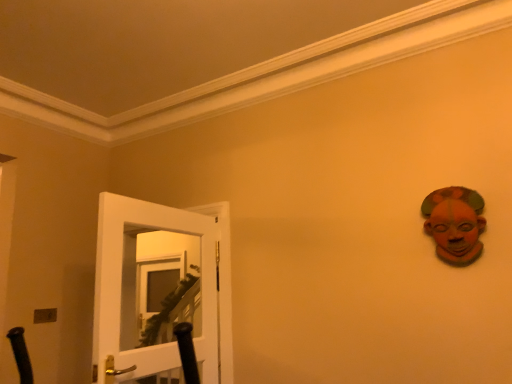
Question: Does point (454, 263) appear closer or farther from the camera than point (118, 370)?

Choices:
 (A) closer
 (B) farther

Answer: (B)

Question: Relative to white glossy door at left, is terracotta clay mask at upper right in front or behind?

Choices:
 (A) behind
 (B) front

Answer: (A)

Question: Which of these objects is positioned closest to the terracotta clay mask at upper right?

Choices:
 (A) metallic silver light switch at lower left
 (B) white glossy door at left

Answer: (B)

Question: Which object is the farthest from the metallic silver light switch at lower left?

Choices:
 (A) terracotta clay mask at upper right
 (B) white glossy door at left

Answer: (A)